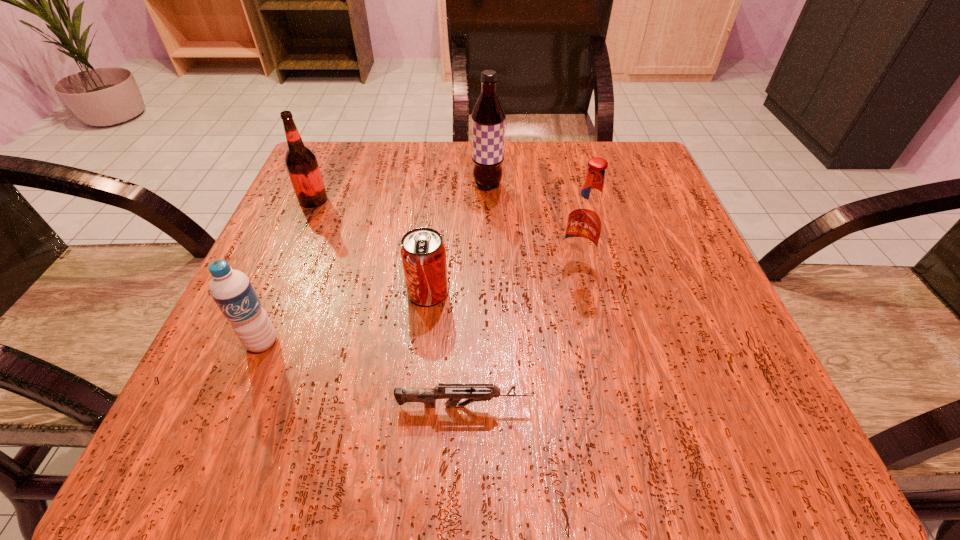
In order to click on free space located 0.100m on the right of the second root beer from right to left in this screenshot , I will do `click(550, 185)`.

The width and height of the screenshot is (960, 540). I want to click on blank space located on the back of the nearest root beer, so click(x=549, y=141).

You are a GUI agent. You are given a task and a screenshot of the screen. Output one action in this format:
    pyautogui.click(x=<x>, y=<y>)
    Task: Click on the free point located on the back of the leftmost root beer
    
    Given the screenshot: What is the action you would take?
    pyautogui.click(x=327, y=168)

Identify the location of vacant space located on the label of the fourth tallest object. (229, 421).

Locate an element on the screen. This screenshot has height=540, width=960. free space located on the right of the pop soda is located at coordinates (607, 292).

Find the location of a particular element. This screenshot has width=960, height=540. vacant space located 0.260m aimed along the barrel of the gun is located at coordinates (728, 406).

At what (x,y) coordinates should I click in order to perform the action: click on object that is at the near edge. Please return your answer as a coordinate pair (x, y). Looking at the image, I should click on (454, 393).

The height and width of the screenshot is (540, 960). What are the coordinates of `root beer that is positioned at the left edge` in the screenshot? It's located at (301, 163).

Identify the location of water bottle that is at the left edge. The height and width of the screenshot is (540, 960). (232, 291).

I want to click on object that is at the far left corner, so click(x=301, y=163).